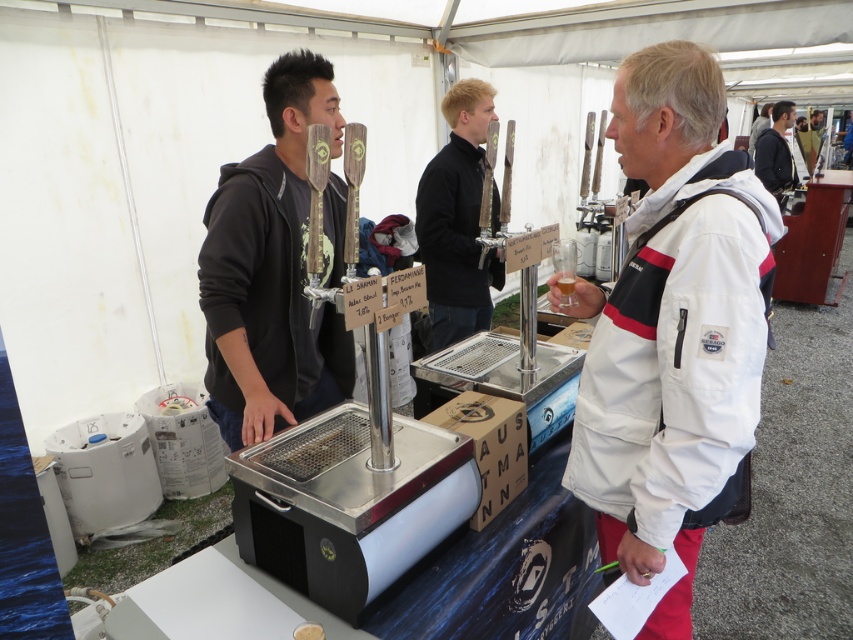
You are organizing a winter event and need to decide which jacket to wear between the white softshell jacket at center and the black hoodie at center. Based on their thickness, which one would provide better insulation?

The black hoodie at center is thicker than the white softshell jacket at center, so it would provide better insulation.

You are a photographer at the event and want to take a group photo of the two people. The camera you have can only focus on subjects within a 1.2 meter range. Will both the white softshell jacket at center and the black matte shirt at center be in focus?

The distance between the white softshell jacket at center and the black matte shirt at center is 1.08 meters, which is within the camera focus range of 1.2 meters. Therefore, both subjects will be in focus.

You are a photographer at the beer tasting event. You want to take a photo of both the white softshell jacket at center and the black hoodie at center so that both are fully visible. Given that the camera can only focus on one subject at a time, which subject should you focus on to ensure the taller one is in focus?

The white softshell jacket at center is taller than the black hoodie at center. Therefore, you should focus on the white softshell jacket at center to ensure the taller subject is in focus.